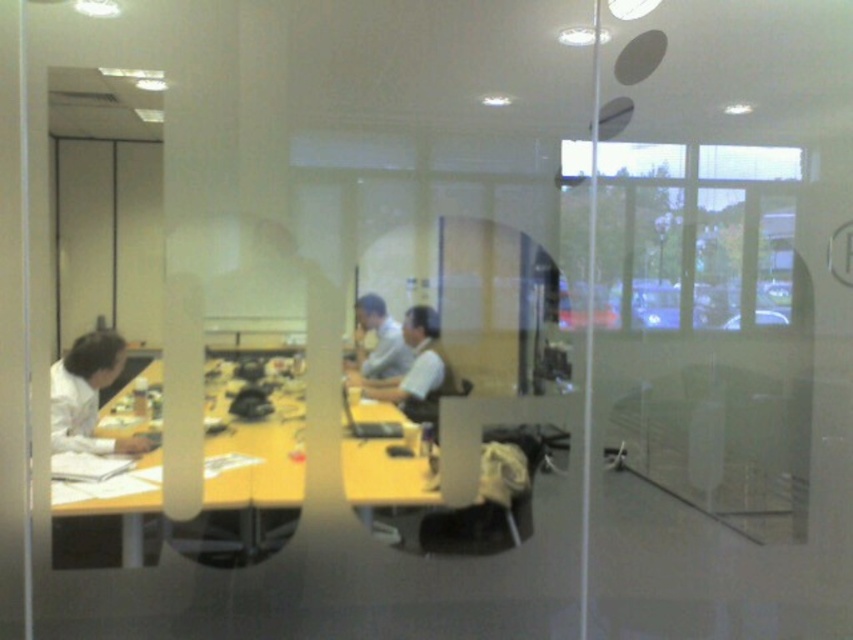
You are standing in the office scene shown. A point at coordinate (248, 476) is part of an object you need to reach. If you can move 2.5 meters forward from your current position, will you be able to reach that point?

The point at coordinate (248, 476) is 2.57 meters away from you. Since you can only move 2.5 meters forward, you will not be able to reach that point as the distance is slightly longer than your movement capability.

You are standing in the office scene shown through the frosted glass. You notice two points marked in the image. Which point, point (122, 413) or point (376, 298), is nearer to your current position?

Point (122, 413) is closer to the camera than point (376, 298), so it is nearer to your current position.

You are standing at the entrance of the office and see two points marked on the table. The first point is at coordinate point[213,442] and the second point is at coordinate point[395,388]. Which point is closer to you?

Point[213,442] is in front of point[395,388], so it is closer to you.